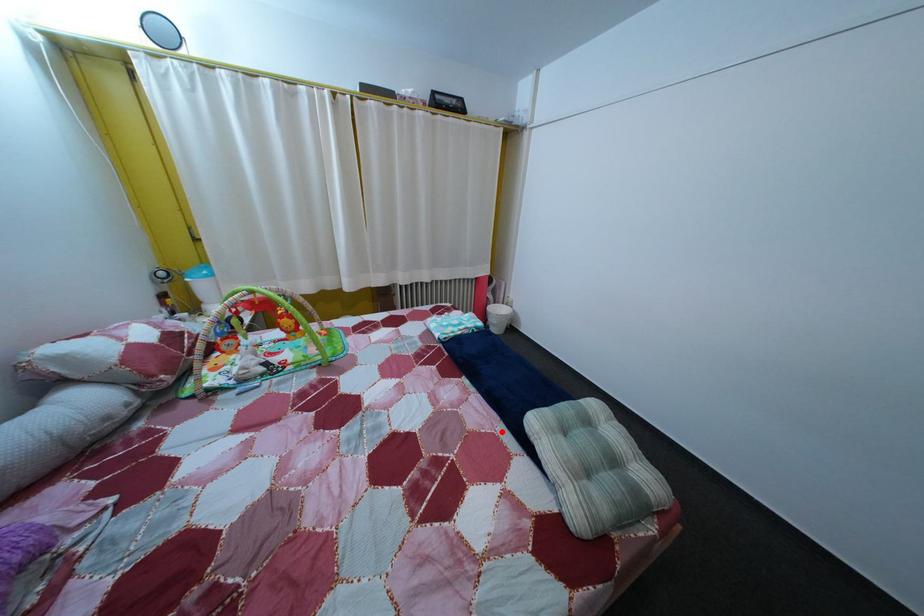
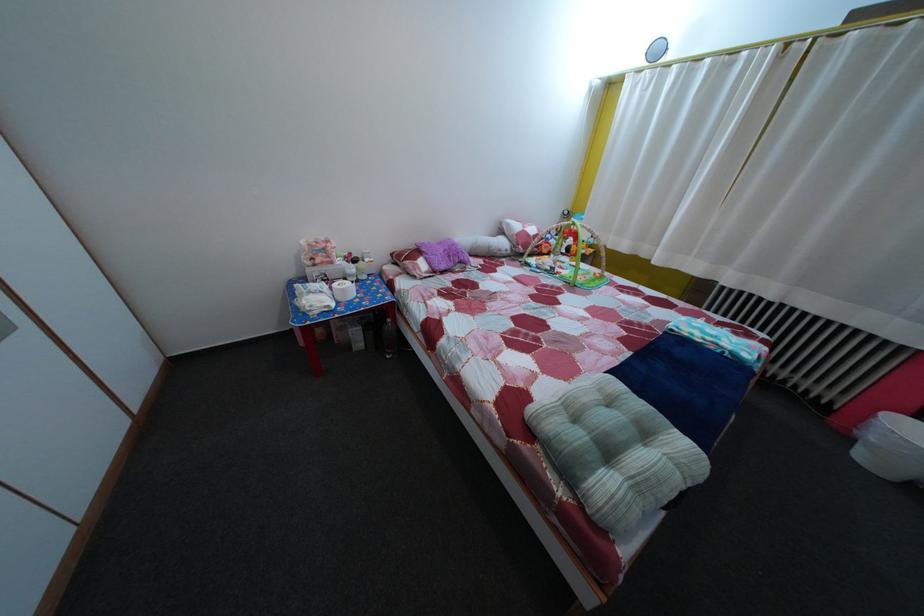
Where in the second image is the point corresponding to the highlighted location from the first image?

(601, 379)